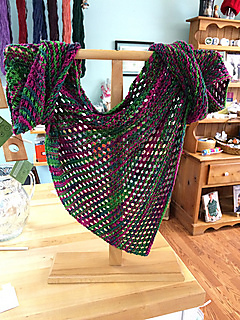
Locate an element on the screen. handle is located at coordinates (31, 192), (31, 174), (8, 168).